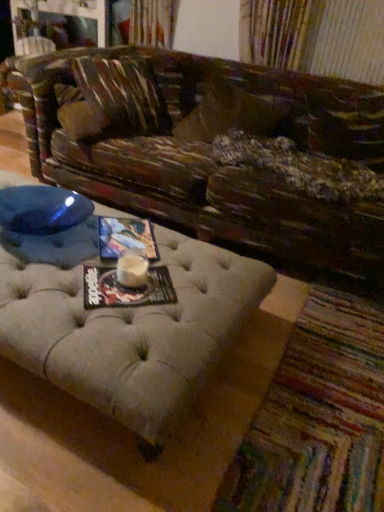
Question: Is matte paper magazine at center, marked as the first magazine in a front-to-back arrangement, to the right of beige tufted ottoman at lower center from the viewer's perspective?

Choices:
 (A) no
 (B) yes

Answer: (A)

Question: Does matte paper magazine at center, marked as the first magazine in a front-to-back arrangement, have a larger size compared to beige tufted ottoman at lower center?

Choices:
 (A) yes
 (B) no

Answer: (B)

Question: Considering the relative sizes of matte paper magazine at center, marked as the first magazine in a front-to-back arrangement, and beige tufted ottoman at lower center in the image provided, is matte paper magazine at center, marked as the first magazine in a front-to-back arrangement, thinner than beige tufted ottoman at lower center?

Choices:
 (A) yes
 (B) no

Answer: (A)

Question: Is beige tufted ottoman at lower center at the back of matte paper magazine at center, the 2th magazine viewed from the back?

Choices:
 (A) yes
 (B) no

Answer: (B)

Question: Is matte paper magazine at center, marked as the first magazine in a front-to-back arrangement, far from beige tufted ottoman at lower center?

Choices:
 (A) yes
 (B) no

Answer: (B)

Question: Do you think leather-like brown pillow at center is within matte paper magazine at center, which ranks as the 2th magazine in front-to-back order, or outside of it?

Choices:
 (A) inside
 (B) outside

Answer: (B)

Question: Considering the positions of leather-like brown pillow at center and matte paper magazine at center, which is counted as the 2th magazine, starting from the bottom, in the image, is leather-like brown pillow at center wider or thinner than matte paper magazine at center, which is counted as the 2th magazine, starting from the bottom,?

Choices:
 (A) wide
 (B) thin

Answer: (A)

Question: Relative to matte paper magazine at center, the 1th magazine when ordered from top to bottom, is leather-like brown pillow at center in front or behind?

Choices:
 (A) front
 (B) behind

Answer: (B)

Question: Considering the positions of leather-like brown pillow at center and matte paper magazine at center, which ranks as the 2th magazine in front-to-back order, in the image, is leather-like brown pillow at center taller or shorter than matte paper magazine at center, which ranks as the 2th magazine in front-to-back order,?

Choices:
 (A) tall
 (B) short

Answer: (A)

Question: In terms of height, does leather-like brown pillow at center look taller or shorter compared to matte paper magazine at center, marked as the first magazine in a front-to-back arrangement?

Choices:
 (A) short
 (B) tall

Answer: (B)

Question: Looking at their shapes, would you say leather-like brown pillow at center is wider or thinner than matte paper magazine at center, the 2th magazine viewed from the back?

Choices:
 (A) wide
 (B) thin

Answer: (A)

Question: Is leather-like brown pillow at center situated inside matte paper magazine at center, marked as the first magazine in a front-to-back arrangement, or outside?

Choices:
 (A) inside
 (B) outside

Answer: (B)

Question: Is point (210, 102) positioned closer to the camera than point (120, 284)?

Choices:
 (A) farther
 (B) closer

Answer: (A)

Question: Is leather-like brown pillow at center wider or thinner than beige tufted ottoman at lower center?

Choices:
 (A) thin
 (B) wide

Answer: (A)

Question: Considering their positions, is leather-like brown pillow at center located in front of or behind beige tufted ottoman at lower center?

Choices:
 (A) behind
 (B) front

Answer: (A)